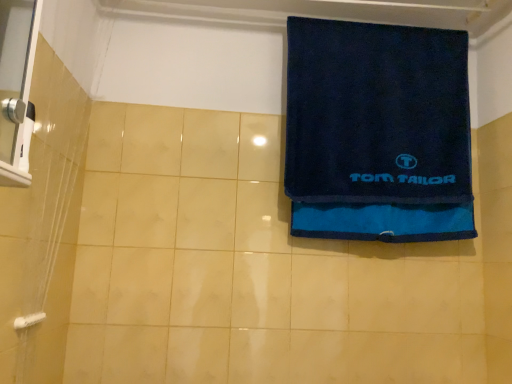
Question: In the image, is dark blue terry cloth towel at upper right positioned in front of or behind white plastic towel bar at lower left?

Choices:
 (A) behind
 (B) front

Answer: (A)

Question: Considering the positions of dark blue terry cloth towel at upper right and white plastic towel bar at lower left in the image, is dark blue terry cloth towel at upper right taller or shorter than white plastic towel bar at lower left?

Choices:
 (A) tall
 (B) short

Answer: (A)

Question: Considering the relative positions of dark blue terry cloth towel at upper right and white plastic towel bar at lower left in the image provided, is dark blue terry cloth towel at upper right to the left or to the right of white plastic towel bar at lower left?

Choices:
 (A) left
 (B) right

Answer: (B)

Question: Considering the positions of white plastic towel bar at lower left and dark blue terry cloth towel at upper right in the image, is white plastic towel bar at lower left wider or thinner than dark blue terry cloth towel at upper right?

Choices:
 (A) thin
 (B) wide

Answer: (A)

Question: From the image's perspective, is white plastic towel bar at lower left above or below dark blue terry cloth towel at upper right?

Choices:
 (A) above
 (B) below

Answer: (B)

Question: From a real-world perspective, is white plastic towel bar at lower left physically located above or below dark blue terry cloth towel at upper right?

Choices:
 (A) above
 (B) below

Answer: (B)

Question: Is white plastic towel bar at lower left bigger or smaller than dark blue terry cloth towel at upper right?

Choices:
 (A) small
 (B) big

Answer: (A)